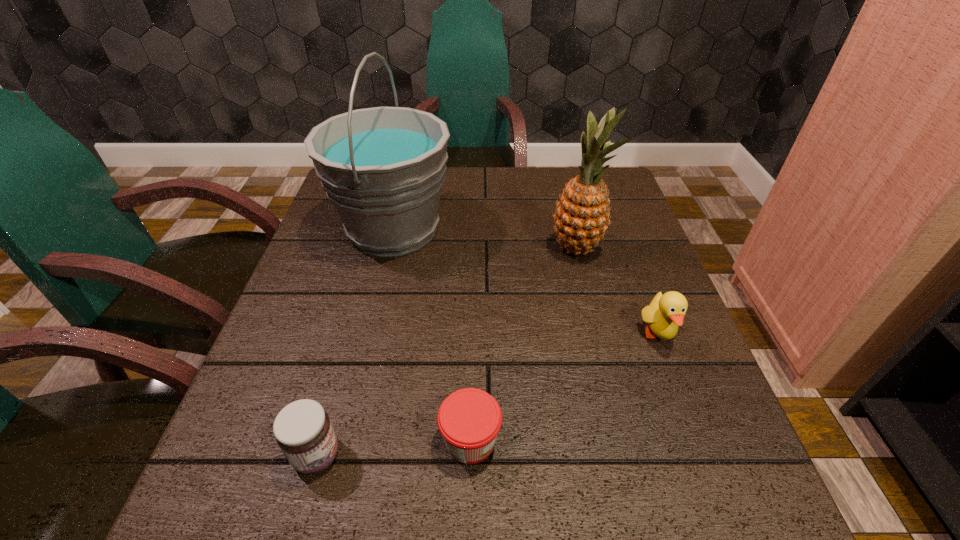
The image size is (960, 540). In order to click on object that is at the near left corner in this screenshot , I will do `click(303, 431)`.

The height and width of the screenshot is (540, 960). I want to click on blank space at the near edge, so click(x=628, y=533).

In the image, there is a desktop. Where is `vacant space at the left edge`? Image resolution: width=960 pixels, height=540 pixels. vacant space at the left edge is located at coordinates (320, 376).

You are a GUI agent. You are given a task and a screenshot of the screen. Output one action in this format:
    pyautogui.click(x=<x>, y=<y>)
    Task: Click on the vacant space at the right edge of the desktop
    
    Given the screenshot: What is the action you would take?
    pyautogui.click(x=628, y=218)

Locate an element on the screen. This screenshot has height=540, width=960. vacant space at the near left corner of the desktop is located at coordinates click(x=275, y=497).

Where is `free space at the far right corner`? The image size is (960, 540). free space at the far right corner is located at coordinates (623, 188).

The width and height of the screenshot is (960, 540). In order to click on free area in between the duckling and the bucket in this screenshot , I will do `click(526, 282)`.

Where is `free spot between the fourth shortest object and the shortest object`? The image size is (960, 540). free spot between the fourth shortest object and the shortest object is located at coordinates [523, 344].

Where is `vacant point located between the left jam and the right jam`? vacant point located between the left jam and the right jam is located at coordinates (394, 448).

Identify the location of blank region between the bucket and the third farthest object. This screenshot has height=540, width=960. (526, 282).